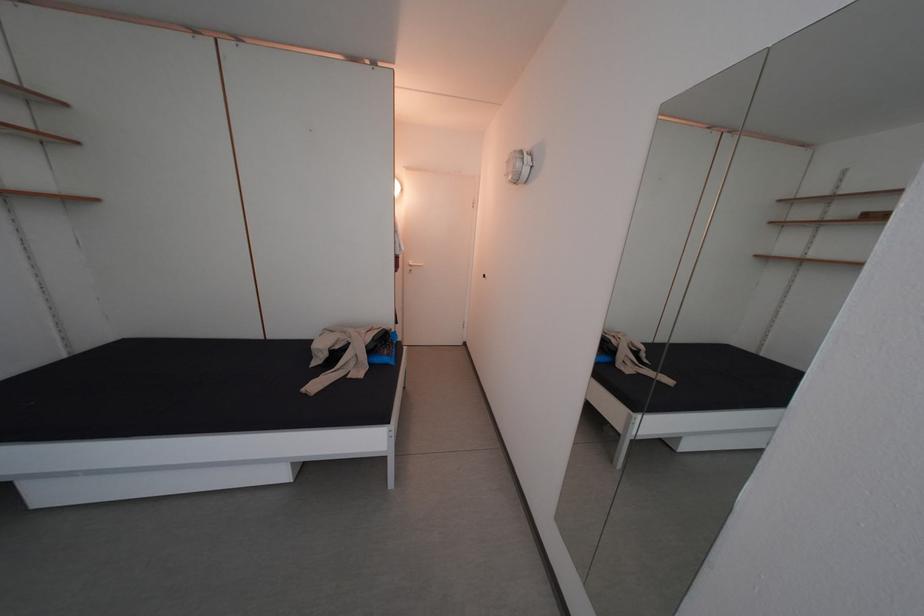
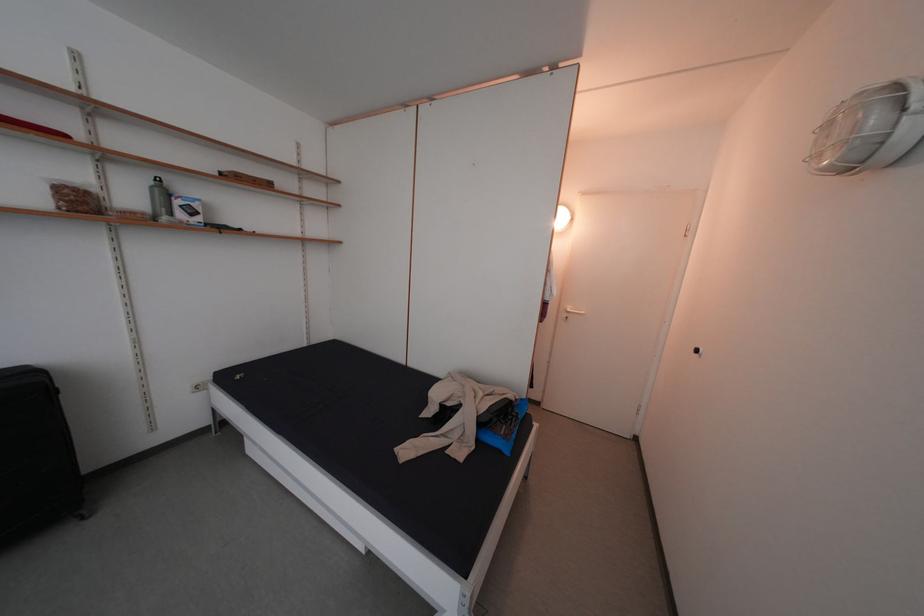
Question: How did the camera likely rotate?

Choices:
 (A) Left
 (B) Right
 (C) Up
 (D) Down

Answer: (A)